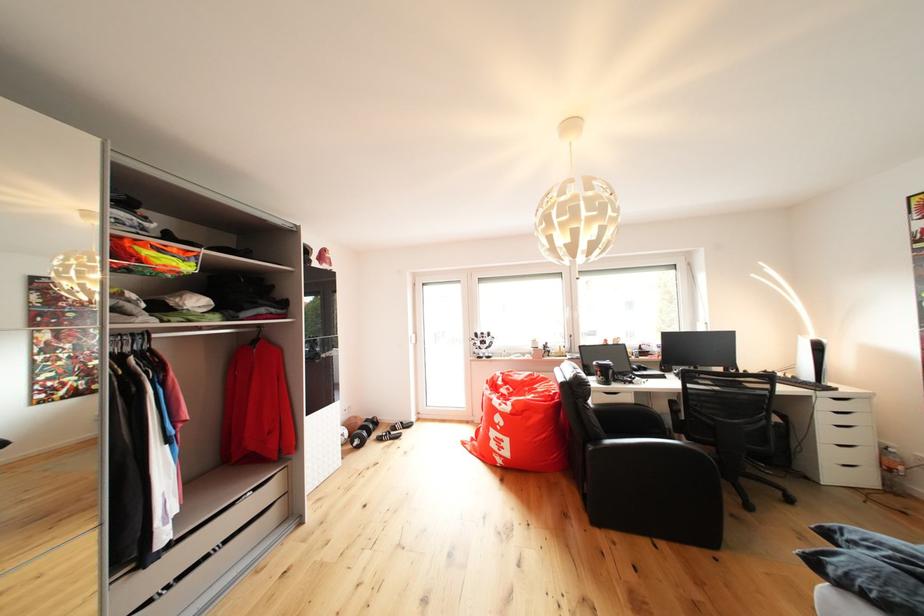
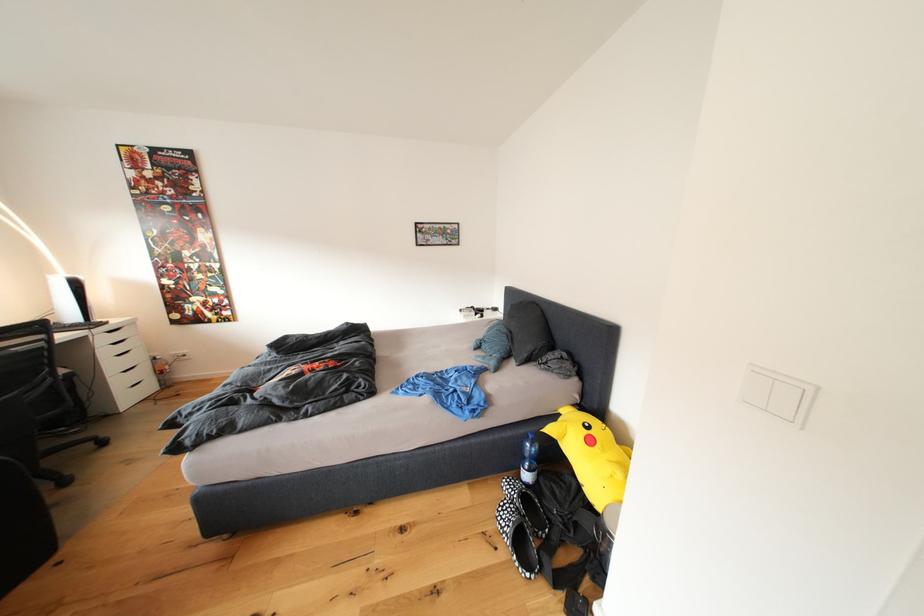
Question: The first image is from the beginning of the video and the second image is from the end. How did the camera likely rotate when shooting the video?

Choices:
 (A) Left
 (B) Right
 (C) Up
 (D) Down

Answer: (B)